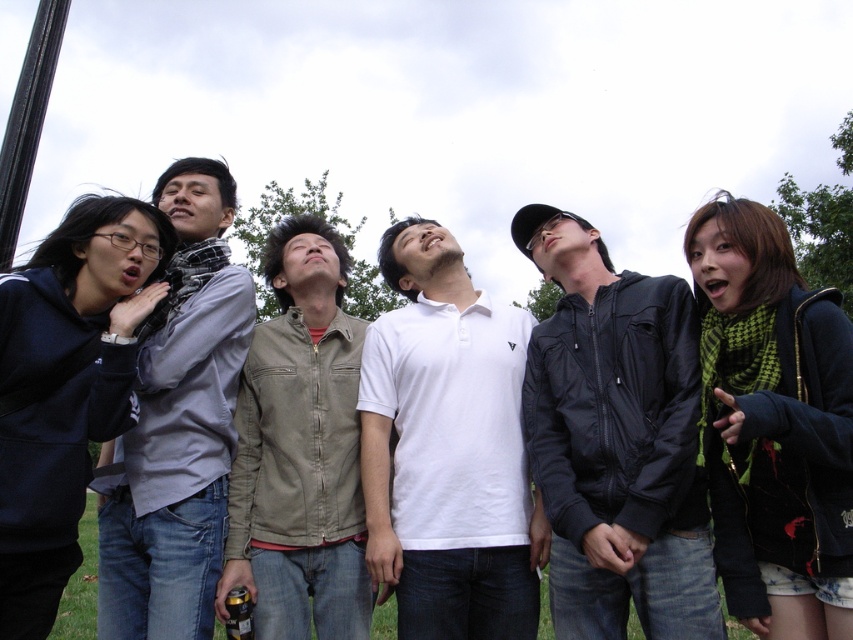
Question: Can you confirm if black leather jacket at center is thinner than green checkered scarf at upper right?

Choices:
 (A) no
 (B) yes

Answer: (A)

Question: Can you confirm if white cotton polo shirt at center is bigger than green checkered scarf at upper right?

Choices:
 (A) no
 (B) yes

Answer: (B)

Question: Which point is farther from the camera taking this photo?

Choices:
 (A) tap(460, 513)
 (B) tap(38, 4)
 (C) tap(334, 577)

Answer: (B)

Question: Which is nearer to the white cotton polo shirt at center?

Choices:
 (A) khaki cotton vest at center
 (B) matte gray scarf at left
 (C) black leather jacket at center

Answer: (A)

Question: Is white cotton polo shirt at center positioned behind matte gray scarf at left?

Choices:
 (A) yes
 (B) no

Answer: (A)

Question: Among these points, which one is farthest from the camera?

Choices:
 (A) (302, 508)
 (B) (25, 268)
 (C) (177, 483)
 (D) (630, 417)

Answer: (A)